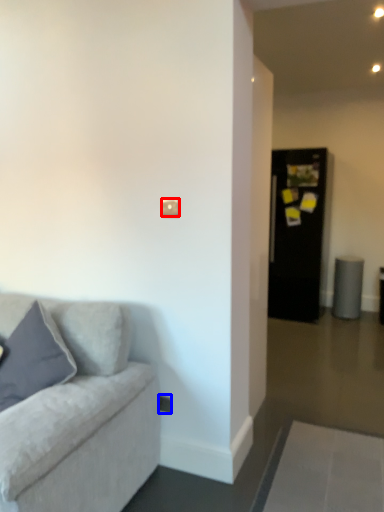
Question: Which object is further to the camera taking this photo, light switch (highlighted by a red box) or electric outlet (highlighted by a blue box)?

Choices:
 (A) light switch
 (B) electric outlet

Answer: (B)